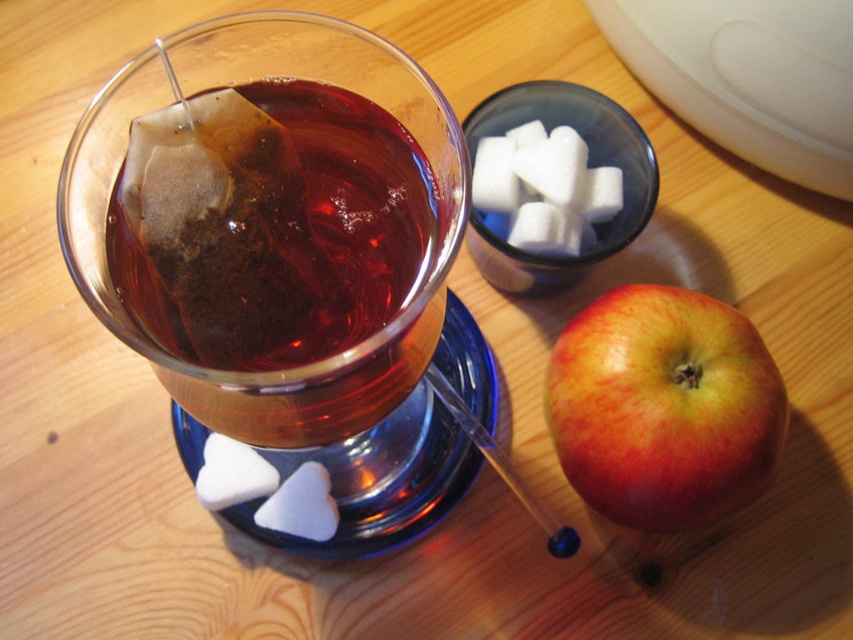
Does point (277, 257) lie behind point (677, 426)?

No, (277, 257) is closer to viewer.

Where is `translucent paper tea bag at upper left`? translucent paper tea bag at upper left is located at coordinates (282, 234).

Image resolution: width=853 pixels, height=640 pixels. Describe the element at coordinates (282, 234) in the screenshot. I see `translucent paper tea bag at upper left` at that location.

You are a GUI agent. You are given a task and a screenshot of the screen. Output one action in this format:
    pyautogui.click(x=<x>, y=<y>)
    Task: Click on the translucent paper tea bag at upper left
    The width and height of the screenshot is (853, 640).
    Given the screenshot: What is the action you would take?
    pyautogui.click(x=282, y=234)